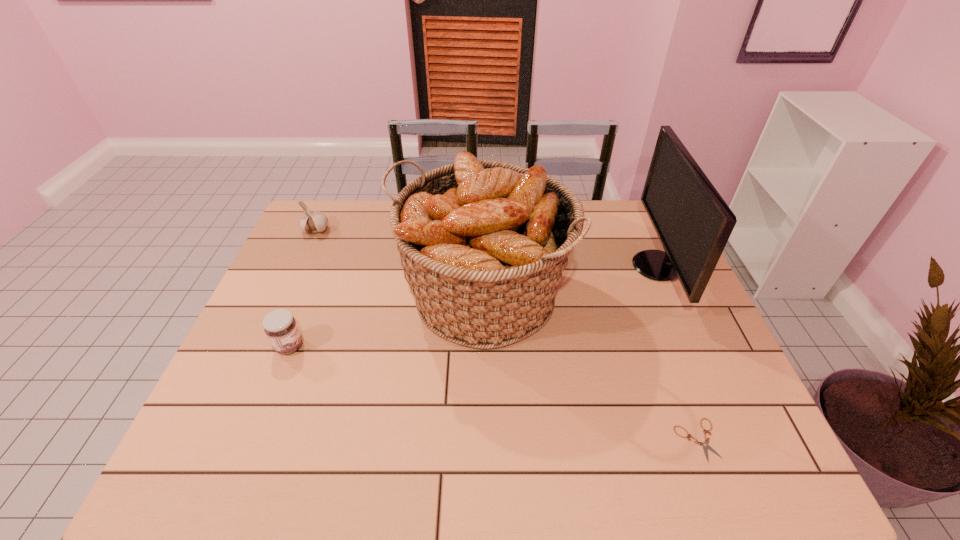
Locate an element on the screen. The width and height of the screenshot is (960, 540). object that is at the far left corner is located at coordinates (312, 222).

Locate an element on the screen. The width and height of the screenshot is (960, 540). object located at the far right corner is located at coordinates (693, 223).

Where is `object present at the near right corner`? This screenshot has height=540, width=960. object present at the near right corner is located at coordinates (705, 445).

Where is `vacant region at the near edge of the desktop`? Image resolution: width=960 pixels, height=540 pixels. vacant region at the near edge of the desktop is located at coordinates (601, 475).

At what (x,y) coordinates should I click in order to perform the action: click on free space at the left edge of the desktop. Please return your answer as a coordinate pair (x, y). Image resolution: width=960 pixels, height=540 pixels. Looking at the image, I should click on (254, 354).

Find the location of a particular element. The height and width of the screenshot is (540, 960). blank space at the right edge is located at coordinates (714, 350).

In the image, there is a desktop. Identify the location of vacant space at the near left corner. (202, 446).

Find the location of a particular element. This screenshot has width=960, height=540. vacant area between the basket and the jam is located at coordinates (386, 322).

Where is `free space between the third object from right to left and the garlic`? This screenshot has height=540, width=960. free space between the third object from right to left and the garlic is located at coordinates (399, 264).

Image resolution: width=960 pixels, height=540 pixels. In order to click on free area in between the computer monitor and the third object from right to left in this screenshot , I will do `click(569, 282)`.